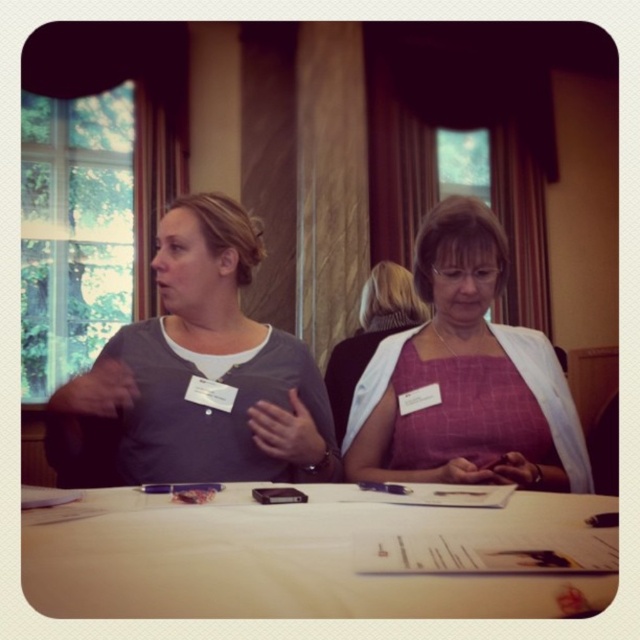
Question: Is white cloth at center bigger than gray matte shirt at center?

Choices:
 (A) no
 (B) yes

Answer: (A)

Question: Which of the following is the closest to the observer?

Choices:
 (A) (440, 294)
 (B) (77, 557)

Answer: (B)

Question: Among these objects, which one is nearest to the camera?

Choices:
 (A) gray matte shirt at center
 (B) white cloth at center

Answer: (B)

Question: Is white cloth at center behind pink fabric dress at center?

Choices:
 (A) yes
 (B) no

Answer: (B)

Question: Is the position of white cloth at center less distant than that of gray matte shirt at center?

Choices:
 (A) no
 (B) yes

Answer: (B)

Question: Which object is farther from the camera taking this photo?

Choices:
 (A) pink fabric dress at center
 (B) gray matte shirt at center

Answer: (B)